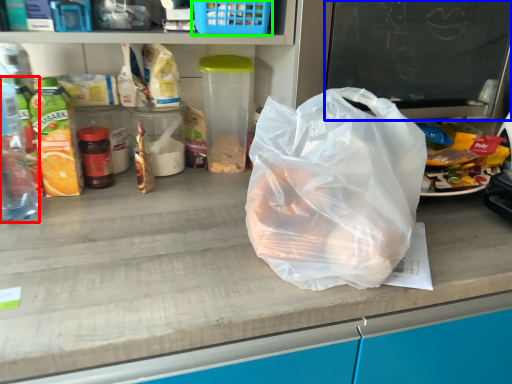
Question: Based on their relative distances, which object is farther from bottle (highlighted by a red box)? Choose from writing (highlighted by a blue box) and basket (highlighted by a green box).

Choices:
 (A) writing
 (B) basket

Answer: (A)